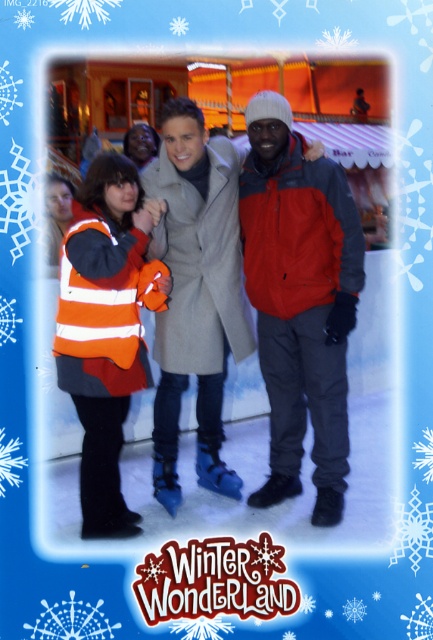
Question: Among these objects, which one is nearest to the camera?

Choices:
 (A) orange striped vest at center
 (B) orange reflective vest at center

Answer: (A)

Question: Does orange reflective vest at center appear on the right side of matte red jacket at center?

Choices:
 (A) yes
 (B) no

Answer: (B)

Question: Is orange reflective vest at center closer to camera compared to matte red jacket at center?

Choices:
 (A) no
 (B) yes

Answer: (A)

Question: Which object appears farthest from the camera in this image?

Choices:
 (A) orange striped vest at center
 (B) orange reflective vest at center
 (C) matte red jacket at center

Answer: (B)

Question: Which of these objects is positioned farthest from the orange striped vest at center?

Choices:
 (A) orange reflective vest at center
 (B) matte red jacket at center

Answer: (B)

Question: Is matte red jacket at center closer to camera compared to orange striped vest at center?

Choices:
 (A) no
 (B) yes

Answer: (A)